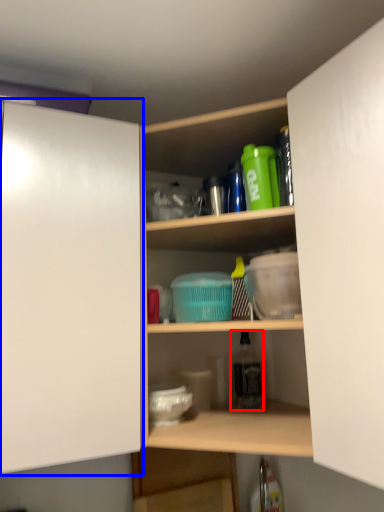
Question: Which object is further to the camera taking this photo, bottle (highlighted by a red box) or cabinetry (highlighted by a blue box)?

Choices:
 (A) bottle
 (B) cabinetry

Answer: (A)